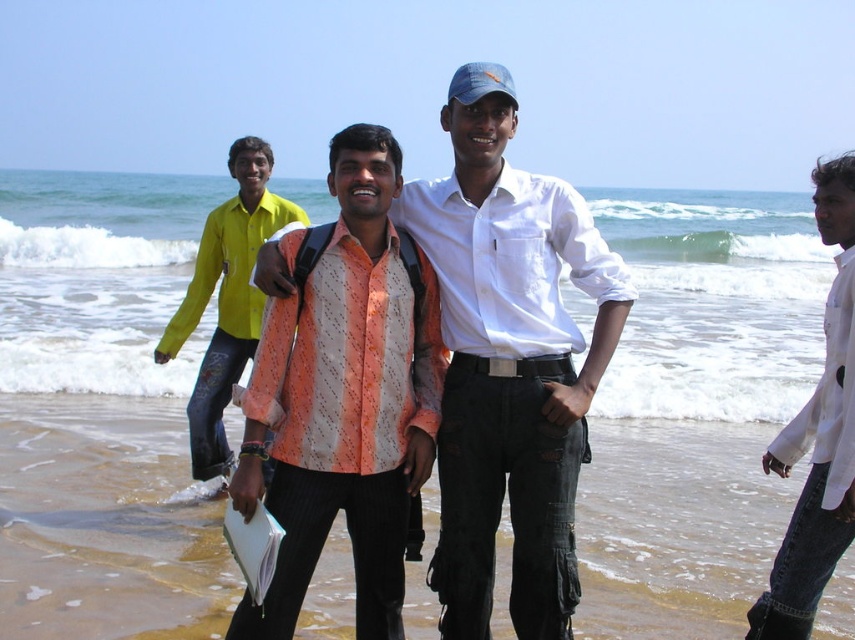
Question: Does clear water at beach front appear under yellow cotton shirt at center?

Choices:
 (A) no
 (B) yes

Answer: (A)

Question: Can you confirm if clear water at beach front is wider than white cotton shirt at right?

Choices:
 (A) yes
 (B) no

Answer: (A)

Question: Which is farther from the white cotton shirt at right?

Choices:
 (A) patterned fabric shirt at center
 (B) clear water at beach front
 (C) white cotton shirt at center

Answer: (B)

Question: Is white cotton shirt at center below patterned fabric shirt at center?

Choices:
 (A) yes
 (B) no

Answer: (A)

Question: Which of the following is the closest to the observer?

Choices:
 (A) yellow cotton shirt at center
 (B) clear water at beach front
 (C) white cotton shirt at center

Answer: (C)

Question: Which of these objects is positioned closest to the clear water at beach front?

Choices:
 (A) patterned fabric shirt at center
 (B) yellow cotton shirt at center
 (C) white cotton shirt at center
 (D) white cotton shirt at right

Answer: (A)